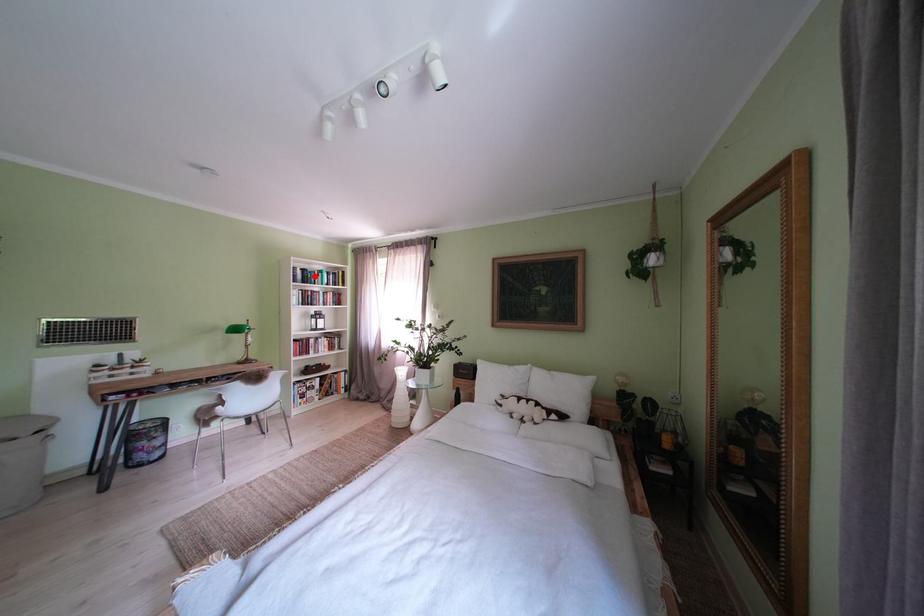
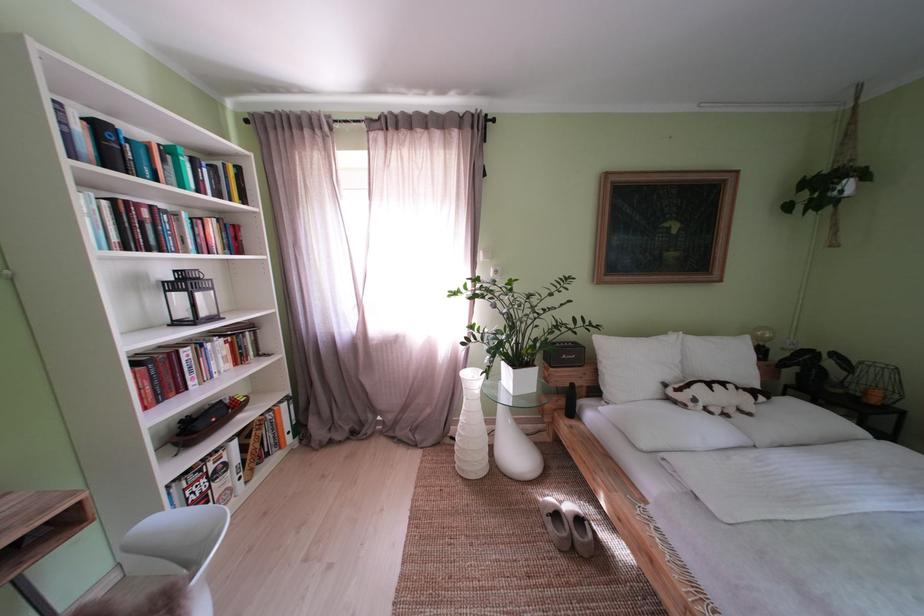
The point at the highlighted location is marked in the first image. Where is the corresponding point in the second image?

(111, 132)